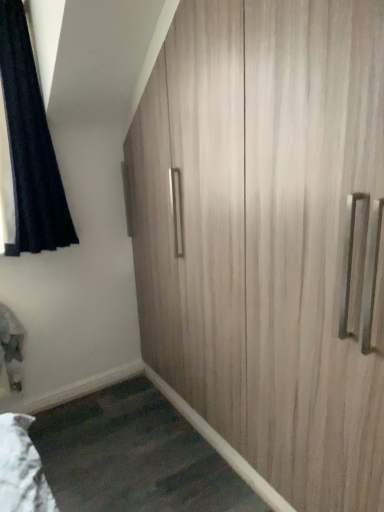
You are a GUI agent. You are given a task and a screenshot of the screen. Output one action in this format:
    pyautogui.click(x=<x>, y=<y>)
    Task: Click on the free spot below black velvet curtain at upper left (from a real-world perspective)
    The height and width of the screenshot is (512, 384).
    Given the screenshot: What is the action you would take?
    pyautogui.click(x=59, y=400)